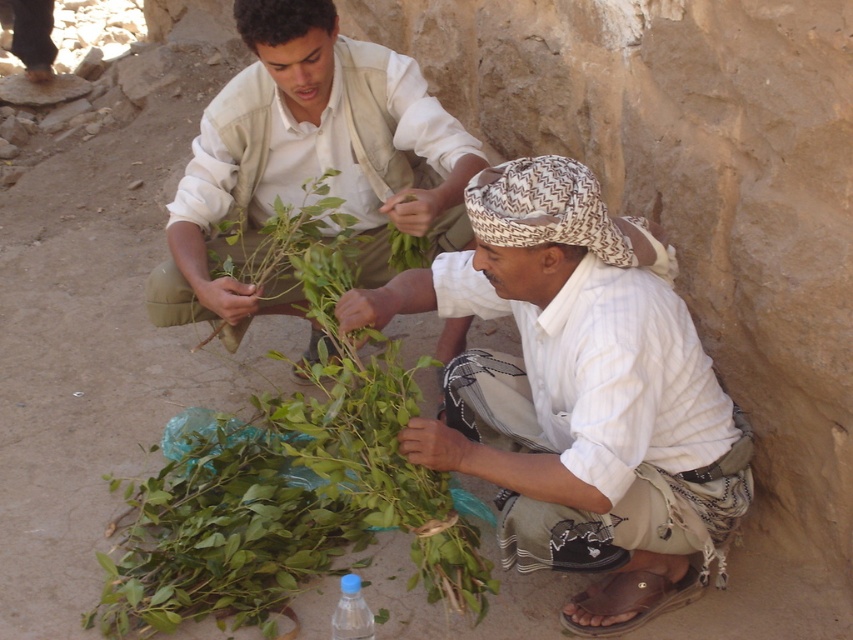
Question: Which point is closer to the camera taking this photo?

Choices:
 (A) (340, 96)
 (B) (351, 579)
 (C) (682, 580)
 (D) (401, 445)

Answer: (D)

Question: Can you confirm if green leafy plant at center is smaller than transparent plastic bottle at lower center?

Choices:
 (A) no
 (B) yes

Answer: (A)

Question: Can you confirm if white striped fabric at center is positioned below green leafy plant at center?

Choices:
 (A) yes
 (B) no

Answer: (B)

Question: Which object appears farthest from the camera in this image?

Choices:
 (A) green leafy plant at center
 (B) transparent plastic bottle at lower center
 (C) light brown fabric shirt at center
 (D) white striped fabric at center

Answer: (C)

Question: Which point appears closest to the camera in this image?

Choices:
 (A) (146, 499)
 (B) (631, 596)
 (C) (368, 630)

Answer: (C)

Question: Is green leafy plant at center smaller than brown leather sandal at lower right?

Choices:
 (A) yes
 (B) no

Answer: (B)